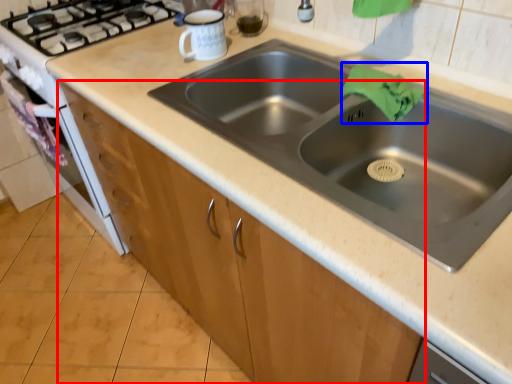
Question: Among these objects, which one is farthest to the camera, cabinetry (highlighted by a red box) or cloth (highlighted by a blue box)?

Choices:
 (A) cabinetry
 (B) cloth

Answer: (A)